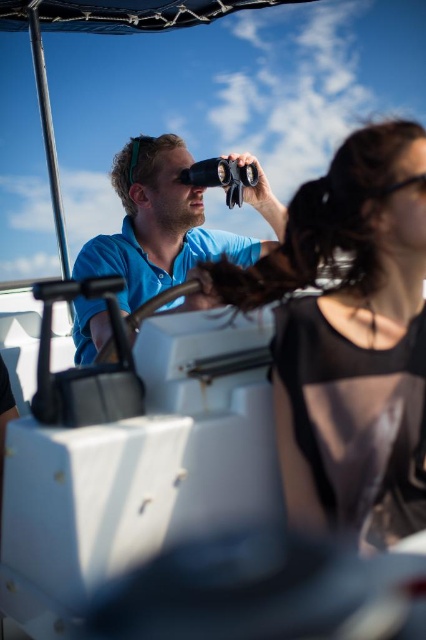
Is black sheer top at upper right above matte blue shirt at center?

No, black sheer top at upper right is not above matte blue shirt at center.

Where is `black sheer top at upper right`? The image size is (426, 640). black sheer top at upper right is located at coordinates (354, 342).

This screenshot has height=640, width=426. I want to click on black sheer top at upper right, so pos(354,342).

Who is shorter, matte blue shirt at center or black rubber goggles at upper right?

black rubber goggles at upper right

Who is positioned more to the left, matte blue shirt at center or black rubber goggles at upper right?

From the viewer's perspective, matte blue shirt at center appears more on the left side.

Which is in front, point (109, 237) or point (379, 189)?

Point (379, 189)

You are a GUI agent. You are given a task and a screenshot of the screen. Output one action in this format:
    pyautogui.click(x=<x>, y=<y>)
    Task: Click on the matte blue shirt at center
    Image resolution: width=426 pixels, height=640 pixels.
    Given the screenshot: What is the action you would take?
    pyautogui.click(x=158, y=225)

Between black sheer top at upper right and black rubber goggles at upper right, which one appears on the right side from the viewer's perspective?

From the viewer's perspective, black rubber goggles at upper right appears more on the right side.

Is the position of black sheer top at upper right less distant than that of black rubber goggles at upper right?

Yes, it is.

Find the location of `black sheer top at upper right`. black sheer top at upper right is located at coordinates pyautogui.click(x=354, y=342).

Identify the location of black sheer top at upper right. (354, 342).